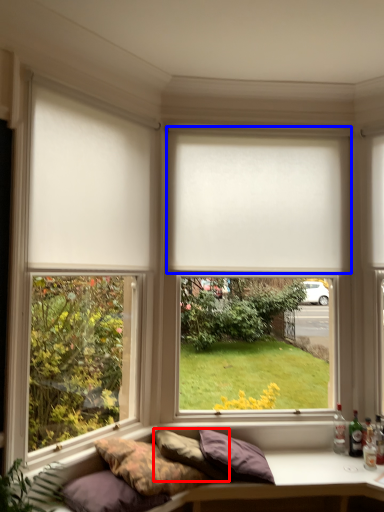
Question: Which object appears farthest to the camera in this image, pillow (highlighted by a red box) or window blind (highlighted by a blue box)?

Choices:
 (A) pillow
 (B) window blind

Answer: (B)